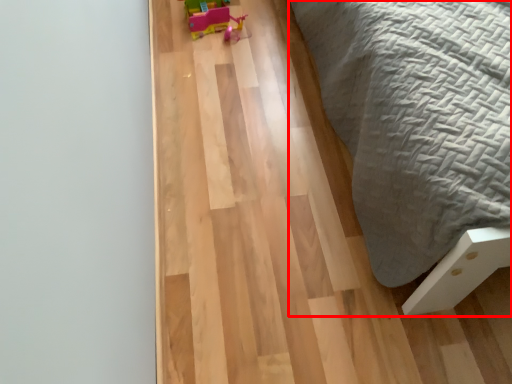
Question: From the image's perspective, what is the correct spatial relationship of furniture (annotated by the red box) in relation to toy?

Choices:
 (A) below
 (B) above

Answer: (A)